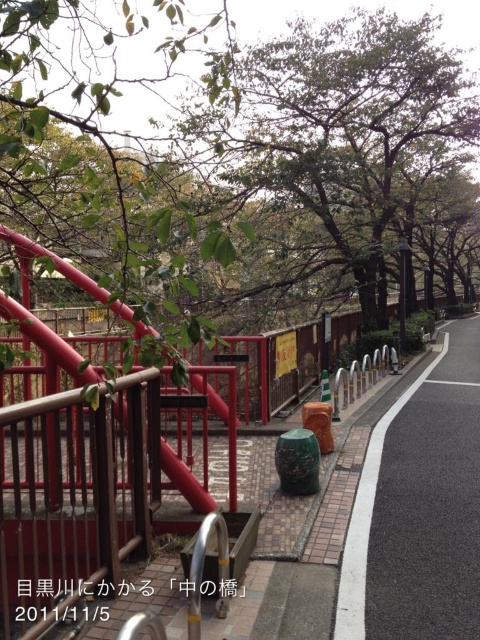
Question: Which of the following is the closest to the observer?

Choices:
 (A) click(x=389, y=499)
 (B) click(x=300, y=269)

Answer: (A)

Question: Among these points, which one is farthest from the camera?

Choices:
 (A) (333, 170)
 (B) (451, 404)

Answer: (A)

Question: Does green leafy tree at center come behind red matte railing at center?

Choices:
 (A) no
 (B) yes

Answer: (B)

Question: Among these objects, which one is farthest from the camera?

Choices:
 (A) red matte railing at center
 (B) asphalt at lower right

Answer: (B)

Question: Does green leafy tree at center have a greater width compared to asphalt at lower right?

Choices:
 (A) no
 (B) yes

Answer: (B)

Question: Observing the image, what is the correct spatial positioning of green leafy tree at center in reference to asphalt at lower right?

Choices:
 (A) right
 (B) left

Answer: (B)